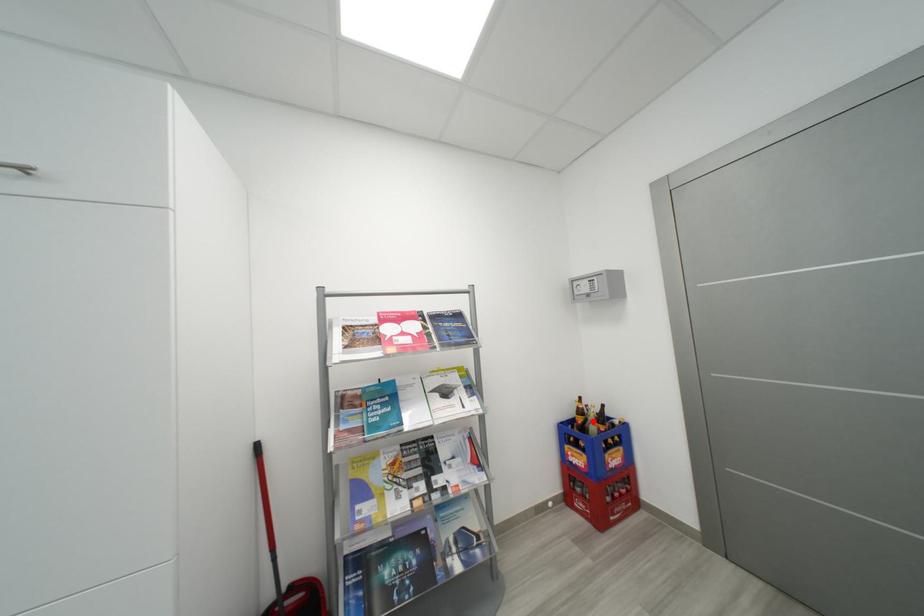
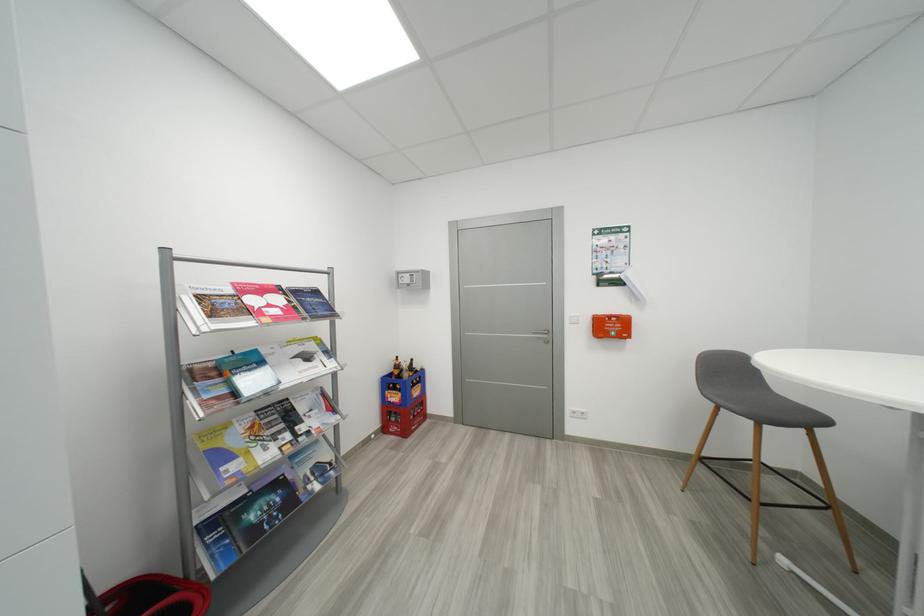
The point at the highlighted location is marked in the first image. Where is the corresponding point in the second image?

(408, 371)